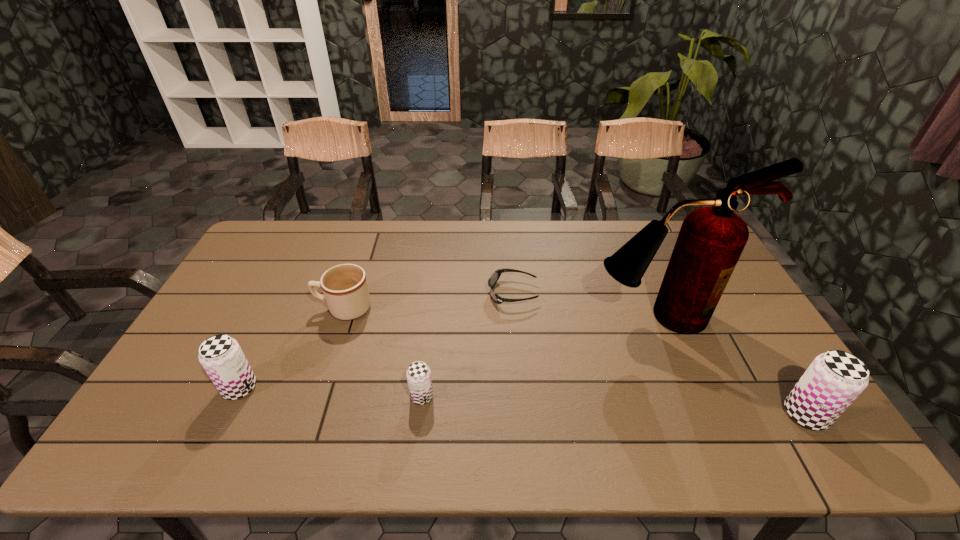
The height and width of the screenshot is (540, 960). Identify the location of free space between the tallest object and the rightmost beer can. (732, 365).

In order to click on vacant point located between the third object from right to left and the mug in this screenshot , I will do `click(428, 301)`.

Identify the location of vacant region between the fifth object from right to left and the fifth tallest object. (383, 352).

Locate an element on the screen. The height and width of the screenshot is (540, 960). vacant area that lies between the sunglasses and the third tallest object is located at coordinates (376, 340).

Locate an element on the screen. free spot between the rightmost beer can and the sunglasses is located at coordinates (659, 354).

Locate an element on the screen. empty space between the rightmost beer can and the third object from right to left is located at coordinates (659, 354).

Where is `vacant area that lies between the sunglasses and the second beer can from left to right`? The height and width of the screenshot is (540, 960). vacant area that lies between the sunglasses and the second beer can from left to right is located at coordinates (468, 345).

Identify the location of vacant space that's between the rightmost beer can and the sunglasses. (659, 354).

The width and height of the screenshot is (960, 540). I want to click on free spot between the leftmost object and the rightmost beer can, so click(522, 401).

Where is `vacant region between the mug and the tallest object`? vacant region between the mug and the tallest object is located at coordinates (502, 312).